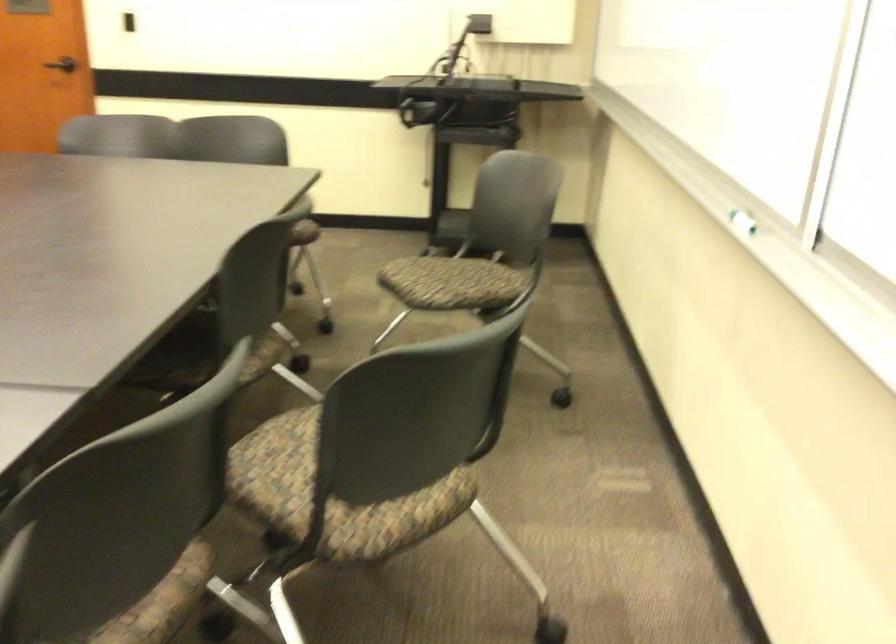
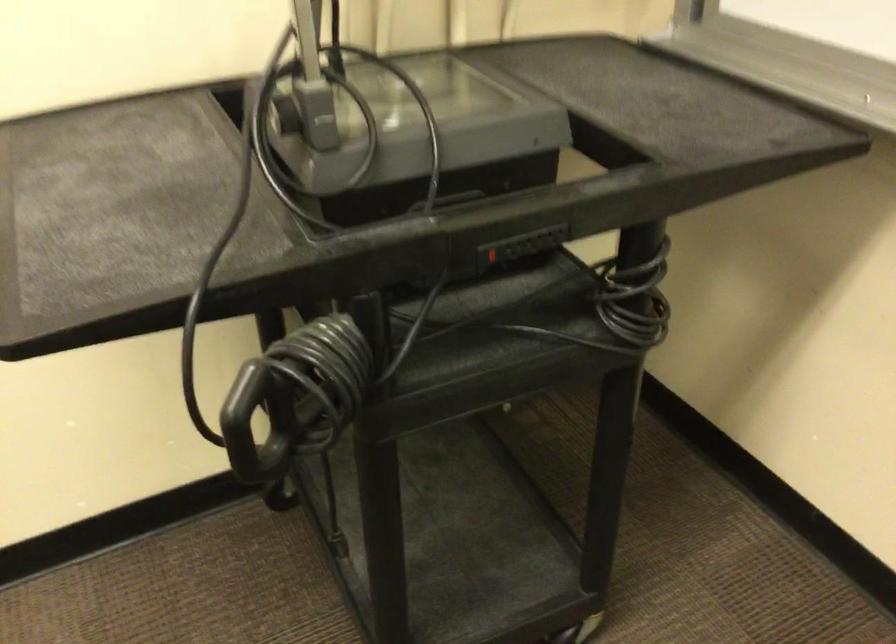
In the second image, find the point that corresponds to point 448,140 in the first image.

(490, 254)